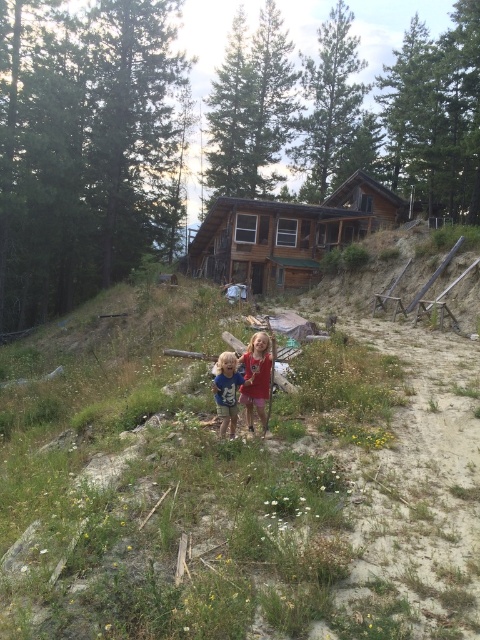
Does green grassy hillside at center come behind brown wooden log cabin at center?

That is False.

Is green grassy hillside at center above brown wooden log cabin at center?

Incorrect, green grassy hillside at center is not positioned above brown wooden log cabin at center.

Between point (176, 410) and point (279, 209), which one is positioned in front?

Point (176, 410)

Locate an element on the screen. green grassy hillside at center is located at coordinates (238, 481).

Is green grassy hillside at center further to the viewer compared to blue denim shorts at center?

No.

The image size is (480, 640). What do you see at coordinates (238, 481) in the screenshot?
I see `green grassy hillside at center` at bounding box center [238, 481].

Describe the element at coordinates (238, 481) in the screenshot. I see `green grassy hillside at center` at that location.

Image resolution: width=480 pixels, height=640 pixels. I want to click on green grassy hillside at center, so click(238, 481).

Between point (255, 381) and point (237, 378), which one is positioned in front?

Point (237, 378) is more forward.

How far apart are matte red shirt at center and blue denim shorts at center?

8.45 inches

Where is `matte red shirt at center`? This screenshot has width=480, height=640. matte red shirt at center is located at coordinates (255, 378).